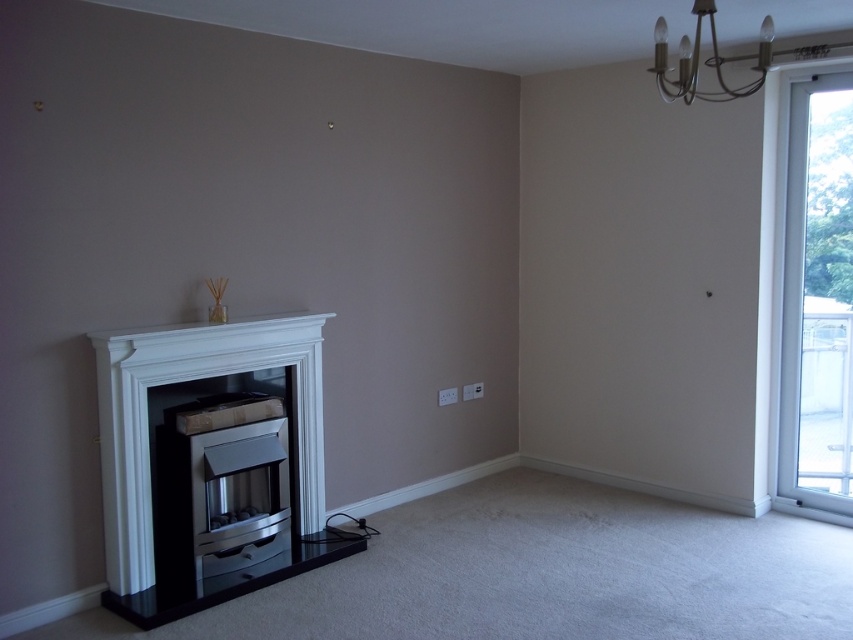
Question: Which object is positioned closest to the metallic chandelier at upper right?

Choices:
 (A) clear glass window at right
 (B) white glossy fireplace at left

Answer: (A)

Question: Which object is closer to the camera taking this photo?

Choices:
 (A) white glossy fireplace at left
 (B) metallic chandelier at upper right
 (C) clear glass window at right

Answer: (B)

Question: Which is nearer to the white glossy fireplace at left?

Choices:
 (A) metallic chandelier at upper right
 (B) clear glass window at right

Answer: (A)

Question: Is white glossy fireplace at left positioned at the back of metallic chandelier at upper right?

Choices:
 (A) yes
 (B) no

Answer: (A)

Question: Is clear glass window at right bigger than metallic chandelier at upper right?

Choices:
 (A) yes
 (B) no

Answer: (A)

Question: Is the position of white glossy fireplace at left less distant than that of clear glass window at right?

Choices:
 (A) no
 (B) yes

Answer: (B)